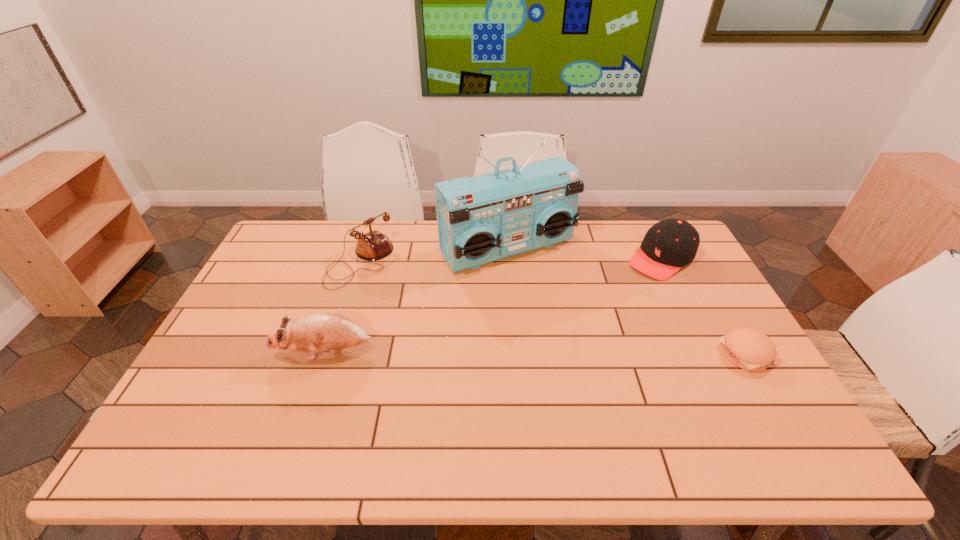
Identify the location of free space between the shortest object and the hamster. This screenshot has width=960, height=540. (535, 353).

Identify the location of vacant area between the shortest object and the cap. (704, 306).

Find the location of a particular element. vacant point located between the third object from left to right and the hamster is located at coordinates (416, 300).

I want to click on blank region between the cap and the patty, so [704, 306].

Locate an element on the screen. This screenshot has width=960, height=540. empty space that is in between the cap and the radio receiver is located at coordinates (585, 253).

Where is `free space between the tallest object and the patty`? The image size is (960, 540). free space between the tallest object and the patty is located at coordinates (627, 301).

You are a GUI agent. You are given a task and a screenshot of the screen. Output one action in this format:
    pyautogui.click(x=<x>, y=<y>)
    Task: Click on the vacant space that is in between the third object from right to left and the patty
    This screenshot has width=960, height=540.
    Given the screenshot: What is the action you would take?
    pyautogui.click(x=627, y=301)

Find the location of a particular element. vacant point located between the telephone and the tallest object is located at coordinates (434, 256).

Where is `vacant point located between the telephone and the tallest object`? The image size is (960, 540). vacant point located between the telephone and the tallest object is located at coordinates (434, 256).

Identify which object is the third closest to the patty. Please provide its 2D coordinates. Your answer should be formatted as a tuple, i.e. [(x, y)], where the tuple contains the x and y coordinates of a point satisfying the conditions above.

[(317, 332)]